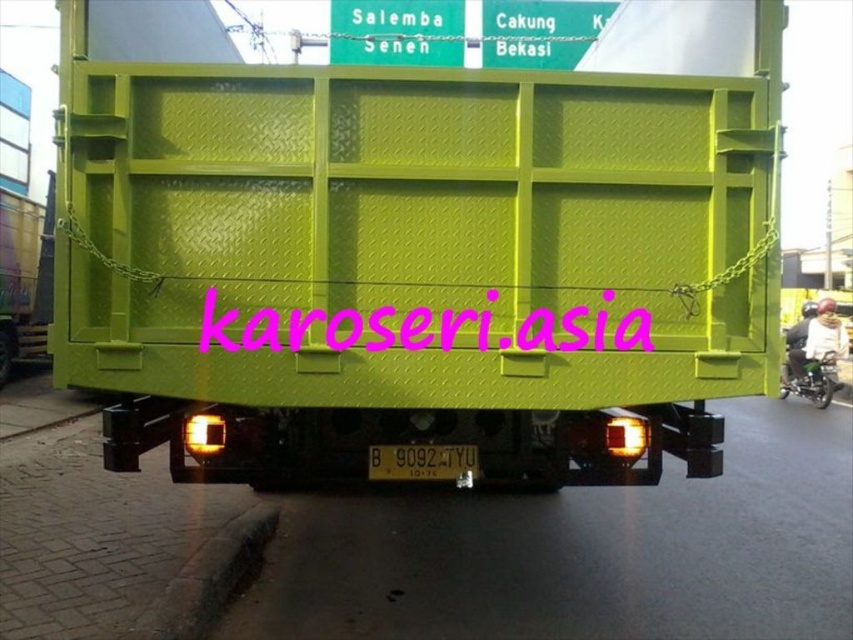
You are a delivery driver who needs to check the height of your cargo. You see a matte green container at center and a black plastic license plate at center on the truck. Which object is taller?

The matte green container at center is much taller than the black plastic license plate at center.

You are standing behind the lime green truck and want to place a small item on the matte green container at center. However, you need to ensure it won not fall off. Considering the position of the black plastic license plate at center, can you determine if the container is tilted forward or backward?

The matte green container at center is closer to the viewer than the black plastic license plate at center, which suggests the container is tilted forward, so placing the item there might be risky as it could slide off.